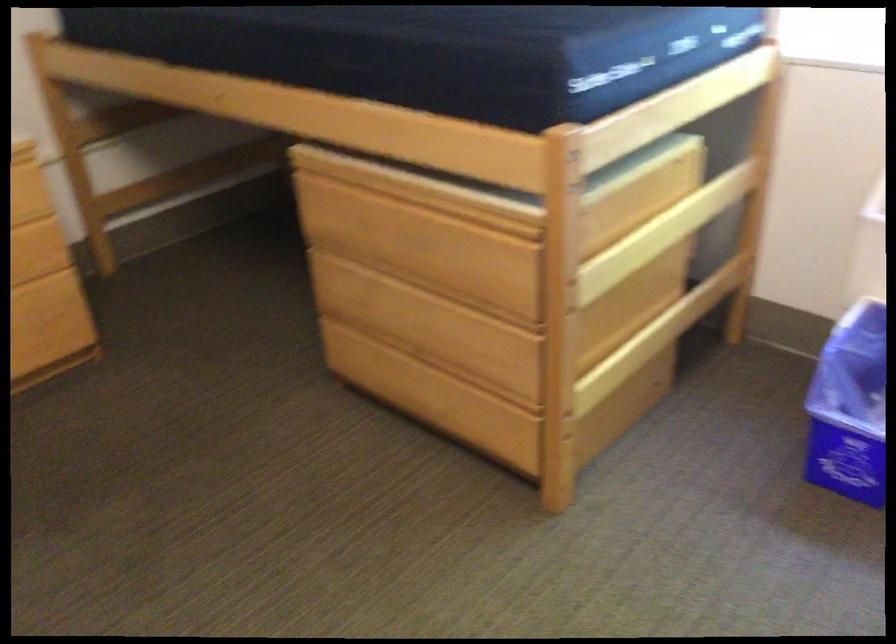
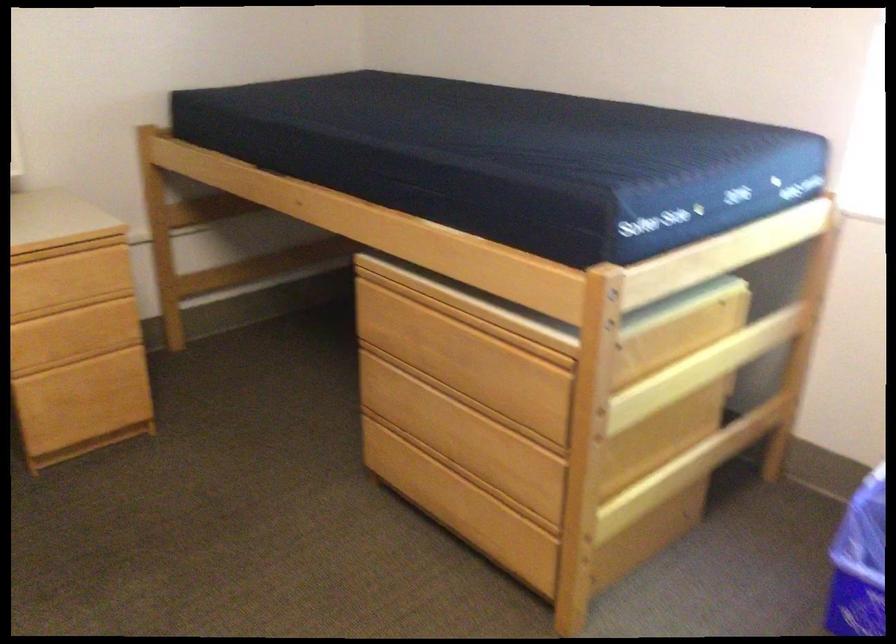
Locate, in the second image, the point that corresponds to (x=400, y=194) in the first image.

(448, 310)